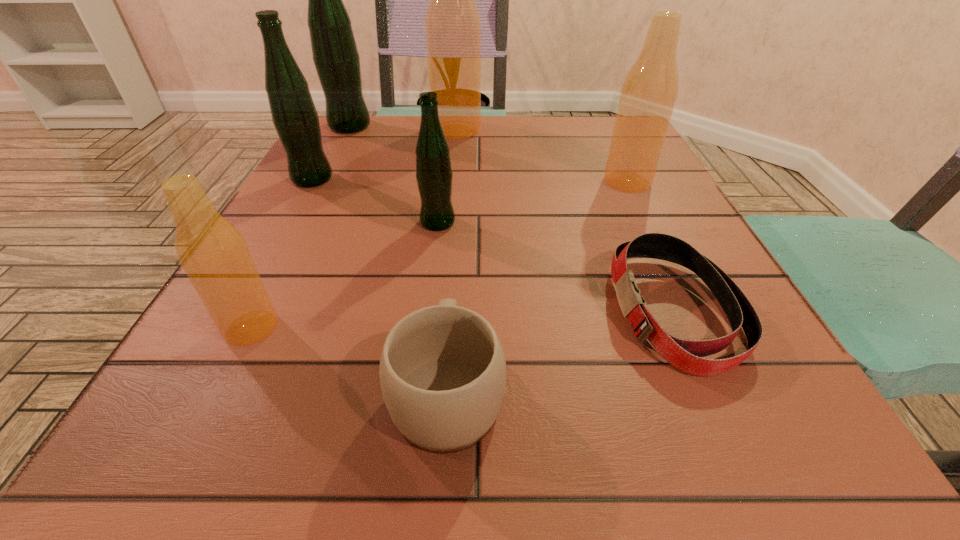
Locate an element on the screen. The height and width of the screenshot is (540, 960). the biggest green beer bottle is located at coordinates (335, 55).

In order to click on the second tan beer bottle from left to right in this screenshot , I will do `click(452, 25)`.

The width and height of the screenshot is (960, 540). In order to click on the farthest tan beer bottle in this screenshot , I will do [x=452, y=25].

Identify the location of the second smallest tan beer bottle. The image size is (960, 540). (649, 92).

Identify the location of the rightmost beer bottle. The image size is (960, 540). (649, 92).

You are a GUI agent. You are given a task and a screenshot of the screen. Output one action in this format:
    pyautogui.click(x=<x>, y=<y>)
    Task: Click on the second farthest green beer bottle
    This screenshot has height=540, width=960.
    Given the screenshot: What is the action you would take?
    pyautogui.click(x=294, y=115)

In order to click on the fifth farthest beer bottle in this screenshot , I will do `click(434, 175)`.

You are a GUI agent. You are given a task and a screenshot of the screen. Output one action in this format:
    pyautogui.click(x=<x>, y=<y>)
    Task: Click on the smallest green beer bottle
    The width and height of the screenshot is (960, 540).
    Given the screenshot: What is the action you would take?
    pyautogui.click(x=434, y=175)

Find the location of a particular element. The image size is (960, 540). the leftmost tan beer bottle is located at coordinates (213, 253).

What are the coordinates of `the smallest tan beer bottle` in the screenshot? It's located at (213, 253).